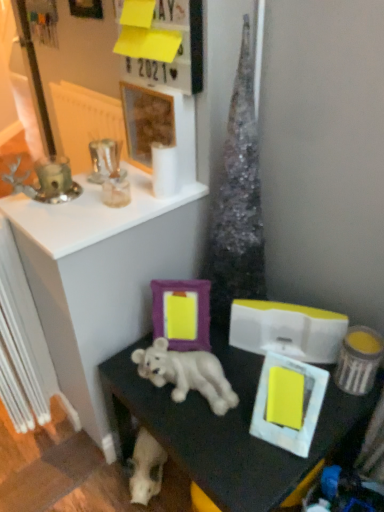
You are a GUI agent. You are given a task and a screenshot of the screen. Output one action in this format:
    pyautogui.click(x=<x>, y=<y>)
    Task: Click on the free space in front of white matte picture frame at lower right, which appears as the first picture frame when viewed from the front
    The image size is (384, 512).
    Given the screenshot: What is the action you would take?
    pyautogui.click(x=273, y=476)